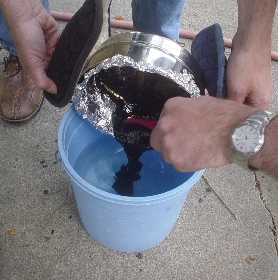
The height and width of the screenshot is (280, 278). Identify the location of bucket. (158, 219).